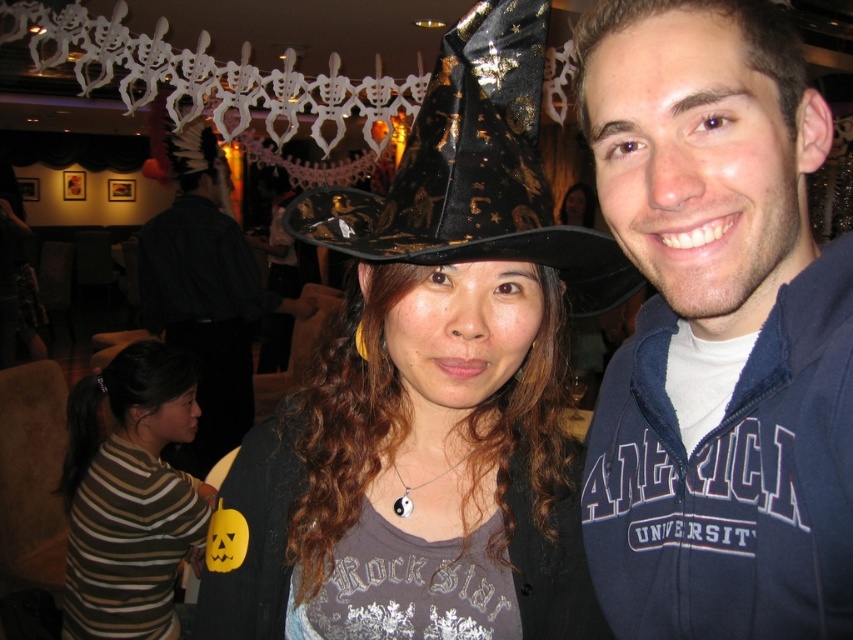
Question: Is black shiny fabric cowboy hat at center above black matte jacket at left?

Choices:
 (A) no
 (B) yes

Answer: (B)

Question: Which point is farther from the camera taking this photo?

Choices:
 (A) [x=474, y=113]
 (B) [x=196, y=301]

Answer: (B)

Question: Is blue fleece jacket at right positioned at the back of brown striped shirt at lower left?

Choices:
 (A) yes
 (B) no

Answer: (B)

Question: Considering the relative positions of blue fleece jacket at right and matte black witch hat at center in the image provided, where is blue fleece jacket at right located with respect to matte black witch hat at center?

Choices:
 (A) above
 (B) below

Answer: (B)

Question: Which of these objects is positioned farthest from the brown striped shirt at lower left?

Choices:
 (A) black matte jacket at left
 (B) matte black witch hat at center
 (C) blue fleece jacket at right

Answer: (B)

Question: Which of the following is the closest to the observer?

Choices:
 (A) blue fleece jacket at right
 (B) matte black witch hat at center

Answer: (A)